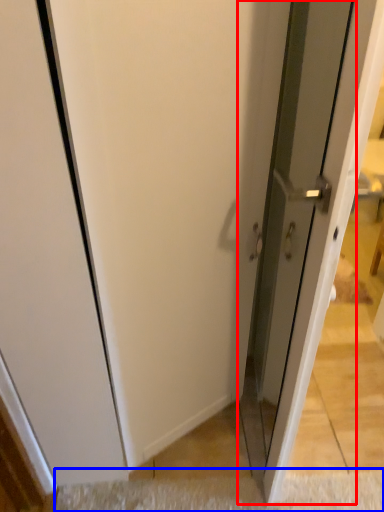
Question: Which object appears closest to the camera in this image, screen door (highlighted by a red box) or doormat (highlighted by a blue box)?

Choices:
 (A) screen door
 (B) doormat

Answer: (A)